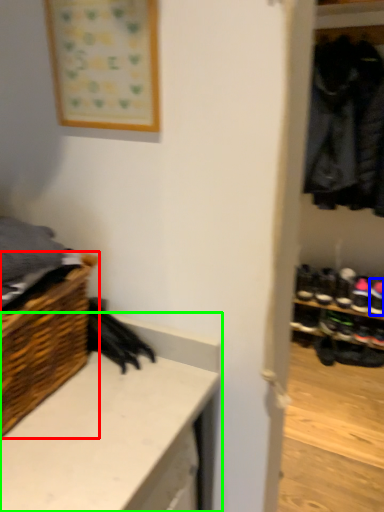
Question: Estimate the real-world distances between objects in this image. Which object is closer to shelf (highlighted by a red box), footwear (highlighted by a blue box) or counter (highlighted by a green box)?

Choices:
 (A) footwear
 (B) counter

Answer: (B)